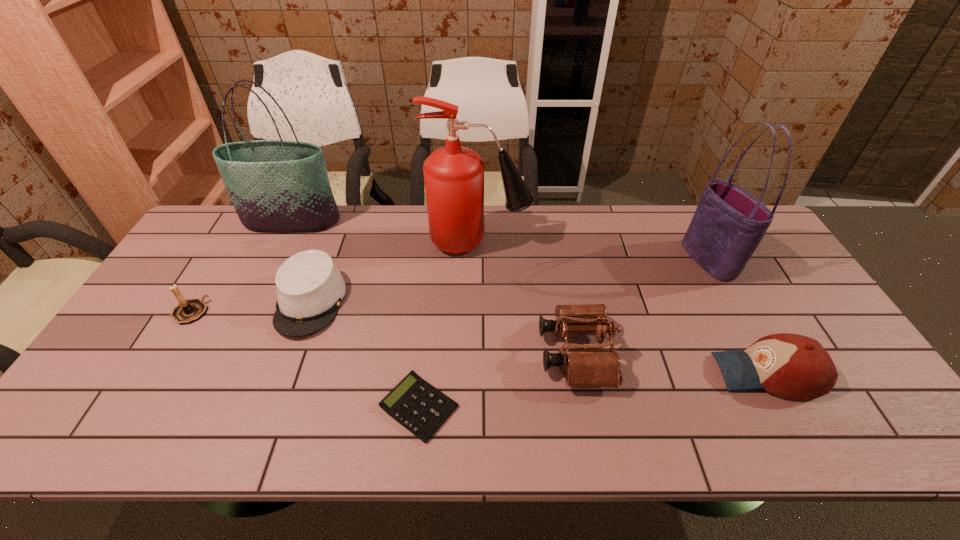
In the image, there is a desktop. At what (x,y) coordinates should I click in order to perform the action: click on free region at the right edge. Please return your answer as a coordinate pair (x, y). The width and height of the screenshot is (960, 540). Looking at the image, I should click on (742, 274).

Find the location of a particular element. The width and height of the screenshot is (960, 540). vacant space in between the nearer tote bag and the baseball cap is located at coordinates (738, 317).

This screenshot has width=960, height=540. Identify the location of vacant region between the fire extinguisher and the right tote bag. tap(594, 251).

This screenshot has width=960, height=540. Identify the location of free area in between the baseball cap and the fire extinguisher. (623, 307).

Image resolution: width=960 pixels, height=540 pixels. What are the coordinates of `free space between the candle holder and the hat` in the screenshot? It's located at (251, 307).

The width and height of the screenshot is (960, 540). Identify the location of free space between the seventh tallest object and the fire extinguisher. (395, 272).

Identify the location of free area in between the binoculars and the fire extinguisher. The height and width of the screenshot is (540, 960). (527, 298).

At what (x,y) coordinates should I click in order to perform the action: click on free space between the left tote bag and the binoculars. Please return your answer as a coordinate pair (x, y). Looking at the image, I should click on (434, 287).

Find the location of `empty space that is in between the baseball cap and the candle holder`. empty space that is in between the baseball cap and the candle holder is located at coordinates (479, 342).

Find the location of a particular element. vacant area that lies between the shortest object and the baseball cap is located at coordinates (593, 390).